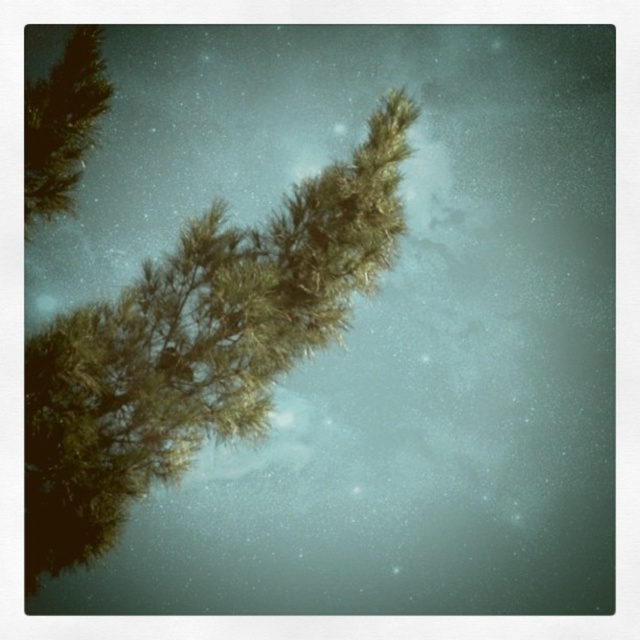
Measure the distance between green textured pine branch at upper left and camera.

They are 37.16 feet apart.

At what (x,y) coordinates should I click in order to perform the action: click on green textured pine branch at upper left. Please return your answer as a coordinate pair (x, y). The height and width of the screenshot is (640, 640). Looking at the image, I should click on (196, 346).